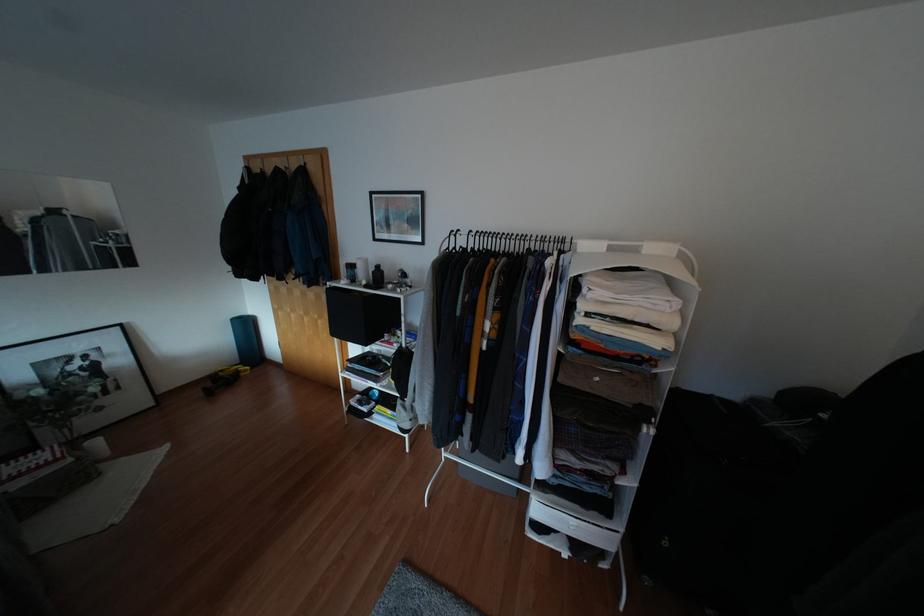
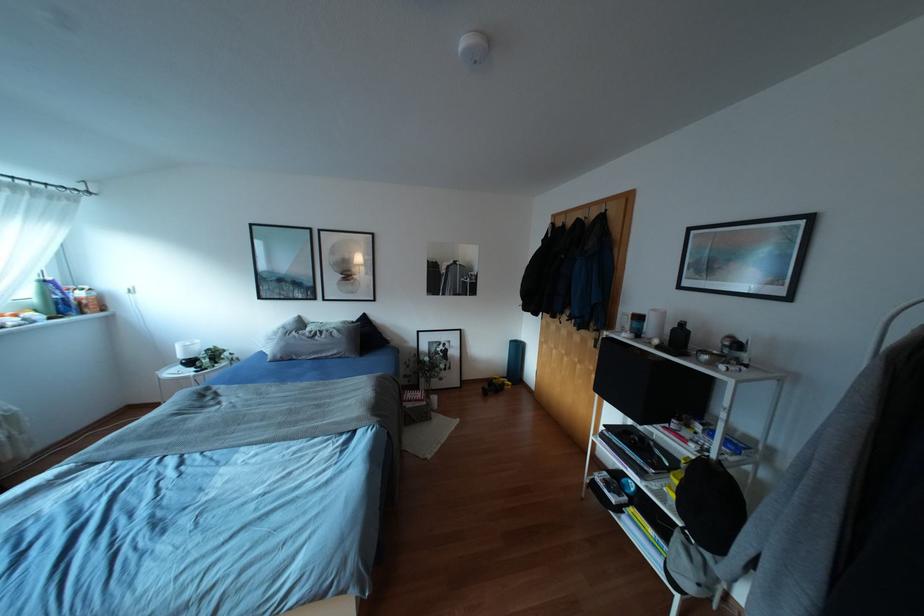
Where in the second image is the point corresponding to [406,346] from the first image?

(719, 461)